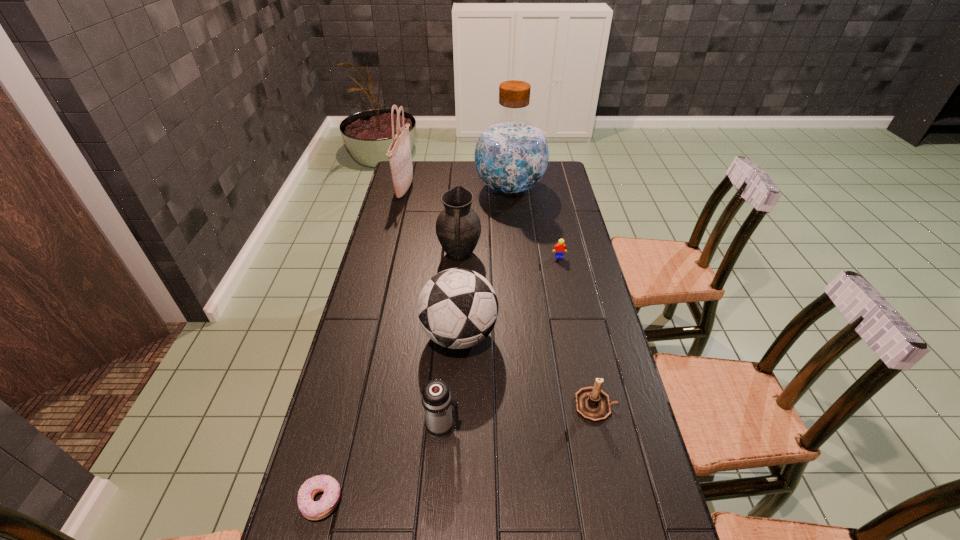
Find the location of `free spot between the water jug and the nearest object`. free spot between the water jug and the nearest object is located at coordinates (416, 345).

Image resolution: width=960 pixels, height=540 pixels. I want to click on the third closest object to the second tallest object, so click(457, 308).

The image size is (960, 540). In order to click on the second closest object to the pitcher in this screenshot , I will do `click(511, 155)`.

This screenshot has width=960, height=540. In order to click on free spot that satisfies the following two spatial constraints: 1. on the surface of the soccer ball where the brand logo is visible; 2. on the front side of the shortest object in this screenshot , I will do `click(452, 501)`.

Identify the location of vacant point that satisfies the following two spatial constraints: 1. on the front-facing side of the second shortest object; 2. on the side with the handle of the thermos bottle. The image size is (960, 540). (594, 428).